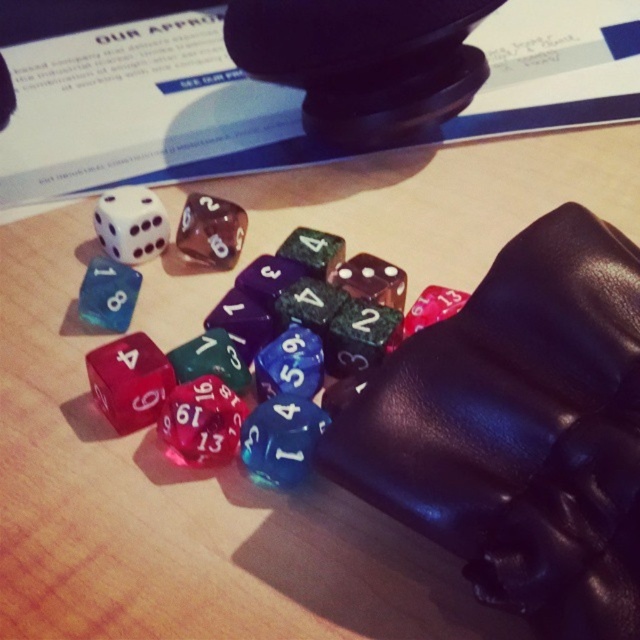
Is point (374, 330) more distant than point (120, 358)?

Yes, it is behind point (120, 358).

Between translucent plastic dice at center and white matte die at center-left, which one appears on the right side from the viewer's perspective?

From the viewer's perspective, translucent plastic dice at center appears more on the right side.

Where is `translucent plastic dice at center`? The image size is (640, 640). translucent plastic dice at center is located at coordinates (268, 365).

Does white matte die at center-left have a smaller size compared to translucent blue die at center-left?

Incorrect, white matte die at center-left is not smaller in size than translucent blue die at center-left.

Does white matte die at center-left have a greater width compared to translucent blue die at center-left?

No.

Describe the element at coordinates (128, 356) in the screenshot. I see `white matte die at center-left` at that location.

You are a GUI agent. You are given a task and a screenshot of the screen. Output one action in this format:
    pyautogui.click(x=<x>, y=<y>)
    Task: Click on the white matte die at center-left
    This screenshot has height=640, width=640.
    Given the screenshot: What is the action you would take?
    pyautogui.click(x=128, y=356)

Can you confirm if translucent plastic dice at center is positioned above translucent blue die at center-left?

Incorrect, translucent plastic dice at center is not positioned above translucent blue die at center-left.

Is translucent plastic dice at center positioned in front of translucent blue die at center-left?

That is True.

I want to click on translucent plastic dice at center, so click(268, 365).

The width and height of the screenshot is (640, 640). In order to click on translucent plastic dice at center in this screenshot , I will do `click(268, 365)`.